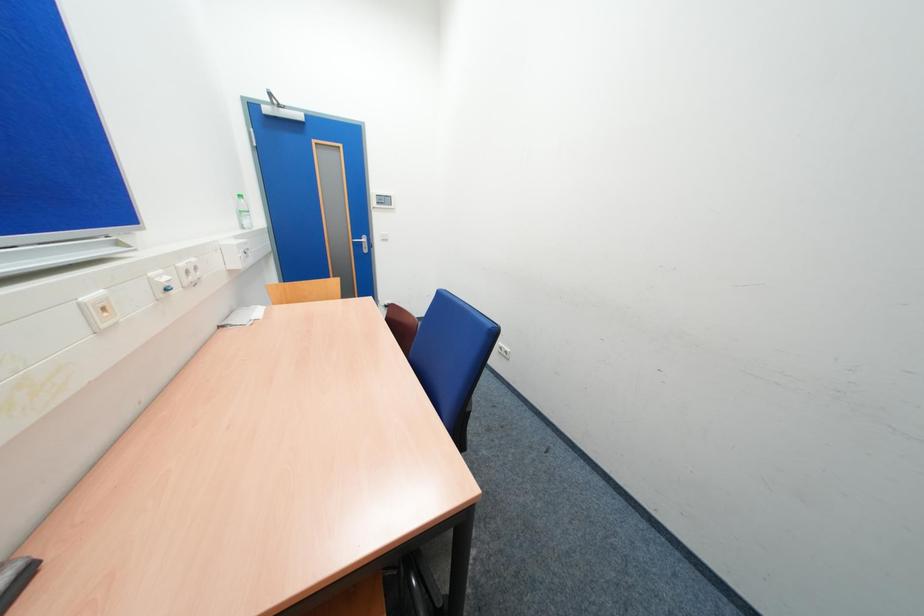
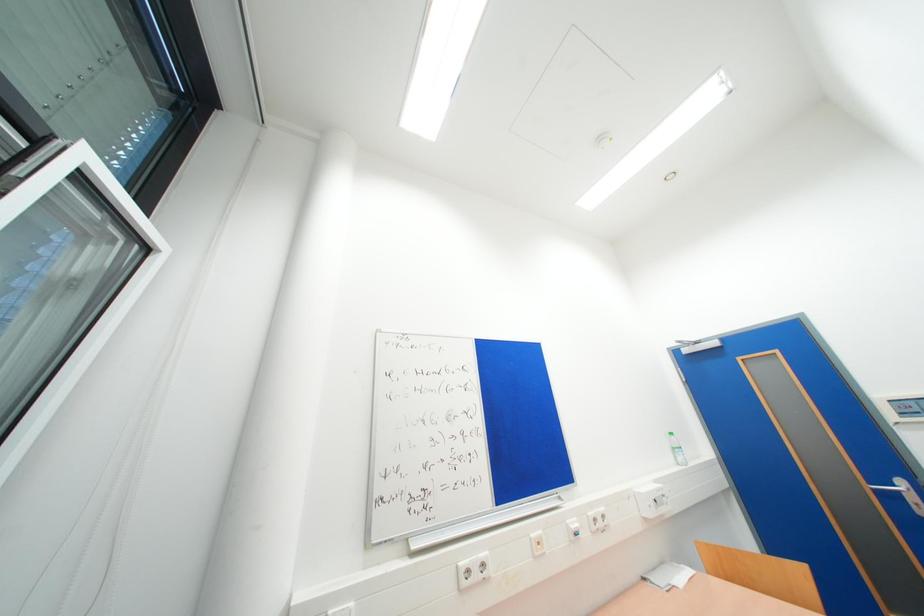
The images are taken continuously from a first-person perspective. In which direction is your viewpoint rotating?

The rotation direction of the camera is left-up.